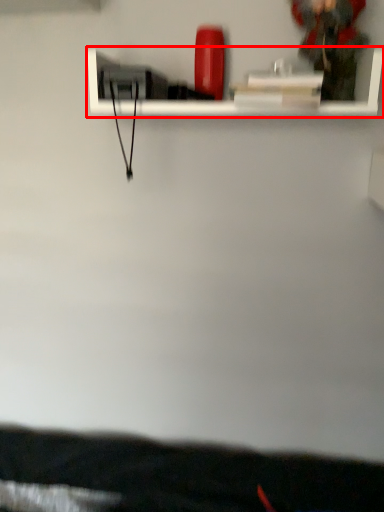
Question: From the image's perspective, considering the relative positions of shelf (annotated by the red box) and person in the image provided, where is shelf (annotated by the red box) located with respect to the staircase?

Choices:
 (A) below
 (B) above

Answer: (A)